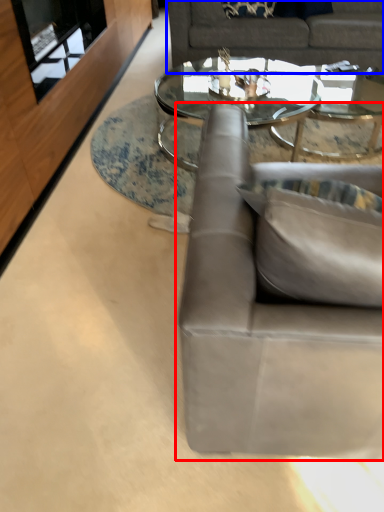
Question: Which object is further to the camera taking this photo, studio couch (highlighted by a red box) or studio couch (highlighted by a blue box)?

Choices:
 (A) studio couch
 (B) studio couch

Answer: (B)